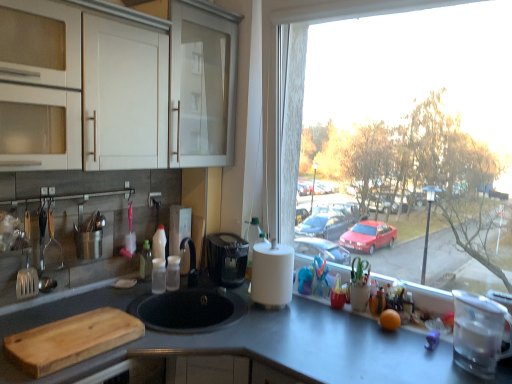
The width and height of the screenshot is (512, 384). I want to click on free spot to the right of white matte paper towel at center, so click(x=313, y=313).